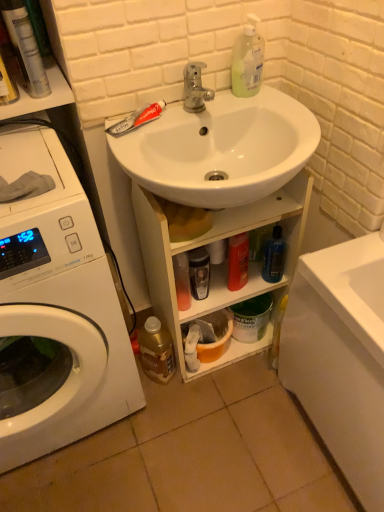
At what (x,y) coordinates should I click in order to perform the action: click on free point to the right of white glossy washing machine at left. Please return your answer as a coordinate pair (x, y). The width and height of the screenshot is (384, 512). Looking at the image, I should click on (211, 429).